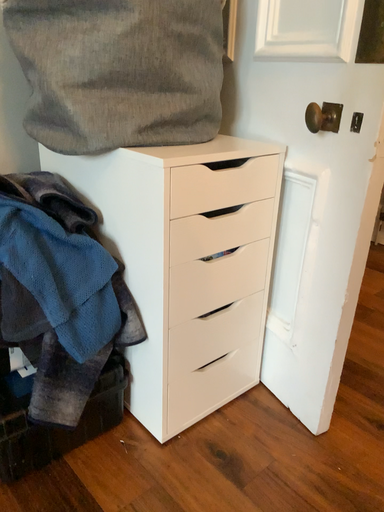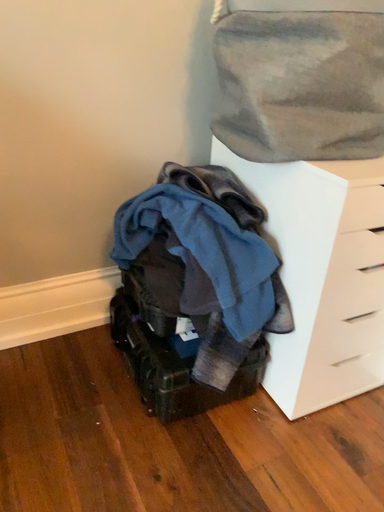
Question: Which way did the camera rotate in the video?

Choices:
 (A) rotated left
 (B) rotated right

Answer: (A)